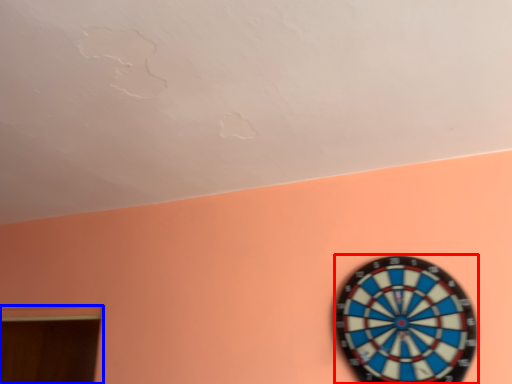
Question: Which of the following is the closest to the observer, clock (highlighted by a red box) or window (highlighted by a blue box)?

Choices:
 (A) clock
 (B) window

Answer: (A)